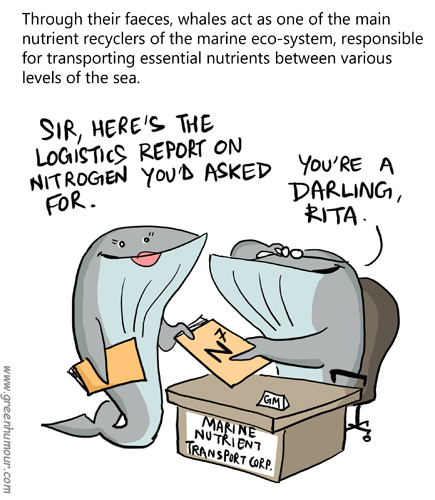
The height and width of the screenshot is (500, 435). Find the location of `folders`. folders is located at coordinates (207, 352), (126, 373).